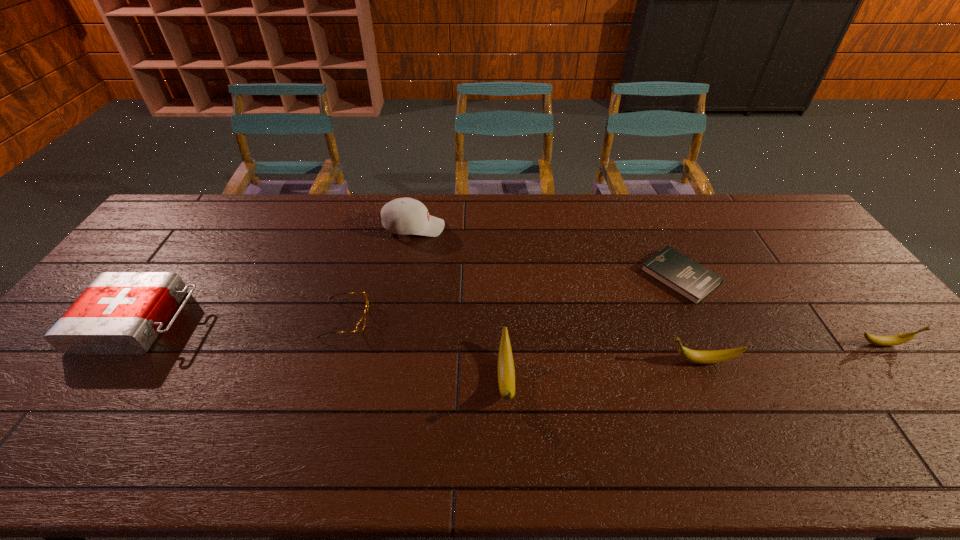
Image resolution: width=960 pixels, height=540 pixels. I want to click on free point that keeps the bananas evenly spaced on the left, so click(x=296, y=399).